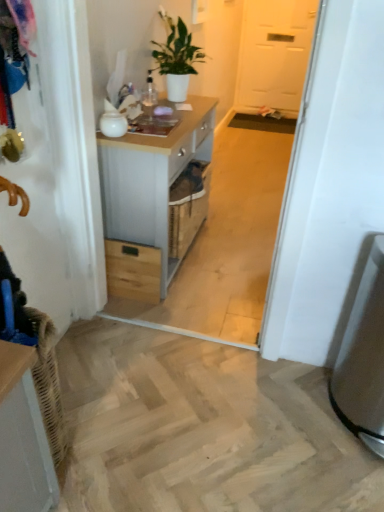
Question: From the image's perspective, is white matte plant at upper center beneath satin silver trash can at lower right?

Choices:
 (A) yes
 (B) no

Answer: (B)

Question: Is white matte plant at upper center completely or partially outside of satin silver trash can at lower right?

Choices:
 (A) no
 (B) yes

Answer: (B)

Question: Can you confirm if white matte plant at upper center is bigger than satin silver trash can at lower right?

Choices:
 (A) yes
 (B) no

Answer: (B)

Question: Considering the relative sizes of white matte plant at upper center and satin silver trash can at lower right in the image provided, is white matte plant at upper center shorter than satin silver trash can at lower right?

Choices:
 (A) no
 (B) yes

Answer: (B)

Question: Considering the relative sizes of white matte plant at upper center and satin silver trash can at lower right in the image provided, is white matte plant at upper center taller than satin silver trash can at lower right?

Choices:
 (A) yes
 (B) no

Answer: (B)

Question: In terms of width, does white matte door at upper center look wider or thinner when compared to white matte plant at upper center?

Choices:
 (A) thin
 (B) wide

Answer: (A)

Question: Which is correct: white matte door at upper center is inside white matte plant at upper center, or outside of it?

Choices:
 (A) outside
 (B) inside

Answer: (A)

Question: Based on their sizes in the image, would you say white matte door at upper center is bigger or smaller than white matte plant at upper center?

Choices:
 (A) big
 (B) small

Answer: (A)

Question: From the image's perspective, is white matte door at upper center located above or below white matte plant at upper center?

Choices:
 (A) above
 (B) below

Answer: (A)

Question: Looking at their shapes, would you say white wood chest of drawers at center is wider or thinner than white matte door at upper center?

Choices:
 (A) thin
 (B) wide

Answer: (B)

Question: From a real-world perspective, is white wood chest of drawers at center positioned above or below white matte door at upper center?

Choices:
 (A) below
 (B) above

Answer: (A)

Question: From the image's perspective, is white wood chest of drawers at center located above or below white matte door at upper center?

Choices:
 (A) above
 (B) below

Answer: (B)

Question: Would you say white wood chest of drawers at center is to the left or to the right of white matte door at upper center in the picture?

Choices:
 (A) left
 (B) right

Answer: (A)

Question: Considering the positions of white matte door at upper center and satin silver trash can at lower right in the image, is white matte door at upper center taller or shorter than satin silver trash can at lower right?

Choices:
 (A) short
 (B) tall

Answer: (B)

Question: Is white matte door at upper center situated inside satin silver trash can at lower right or outside?

Choices:
 (A) outside
 (B) inside

Answer: (A)